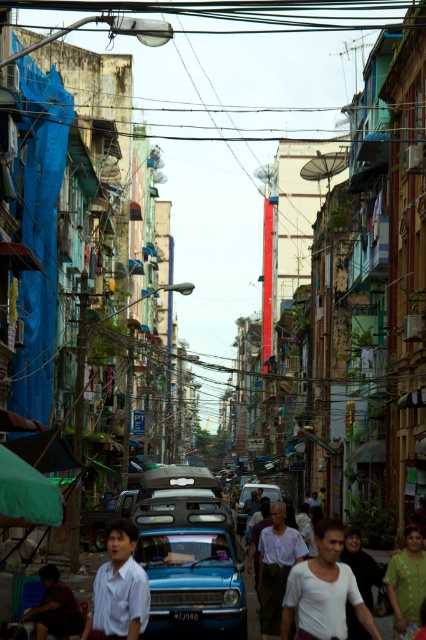
Based on the photo, is green fabric dress at lower right shorter than blue matte car at center?

Yes.

What are the coordinates of `green fabric dress at lower right` in the screenshot? It's located at 406,582.

This screenshot has width=426, height=640. Find the location of `green fabric dress at lower right`. green fabric dress at lower right is located at coordinates (406, 582).

Between blue metallic car at center and light brown fabric shirt at center, which one is positioned lower?

blue metallic car at center is lower down.

Can you confirm if blue metallic car at center is smaller than light brown fabric shirt at center?

Yes, blue metallic car at center is smaller than light brown fabric shirt at center.

Between point (219, 598) and point (284, 522), which one is positioned behind?

The point (284, 522) is more distant.

I want to click on blue metallic car at center, so click(x=192, y=580).

How much distance is there between white matte shirt at center and blue matte car at center?

white matte shirt at center is 42.74 meters from blue matte car at center.

Image resolution: width=426 pixels, height=640 pixels. What do you see at coordinates (324, 589) in the screenshot?
I see `white matte shirt at center` at bounding box center [324, 589].

Does point (311, 570) come behind point (270, 484)?

No, it is not.

Find the location of a particular element. This screenshot has width=426, height=640. white matte shirt at center is located at coordinates (324, 589).